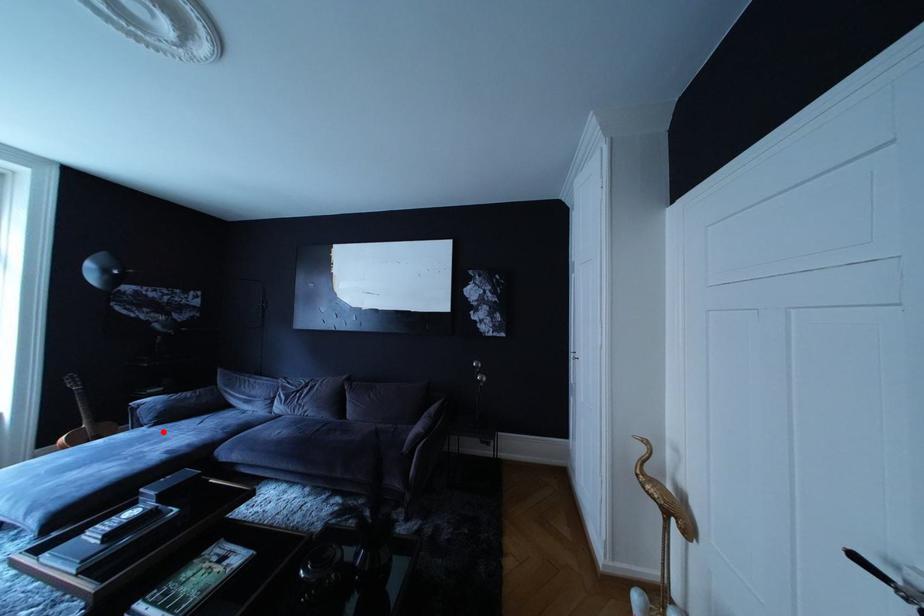
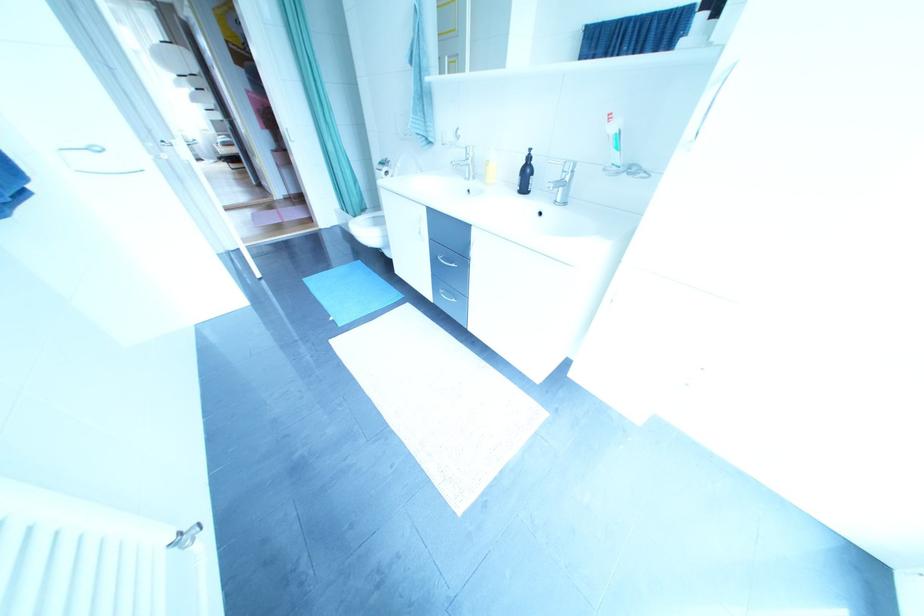
Question: I am providing you with two images of the same scene from different viewpoints. A red point is marked on the first image. At the location where the point appears in image 1, is it still visible in image 2?

Choices:
 (A) Yes
 (B) No

Answer: (B)